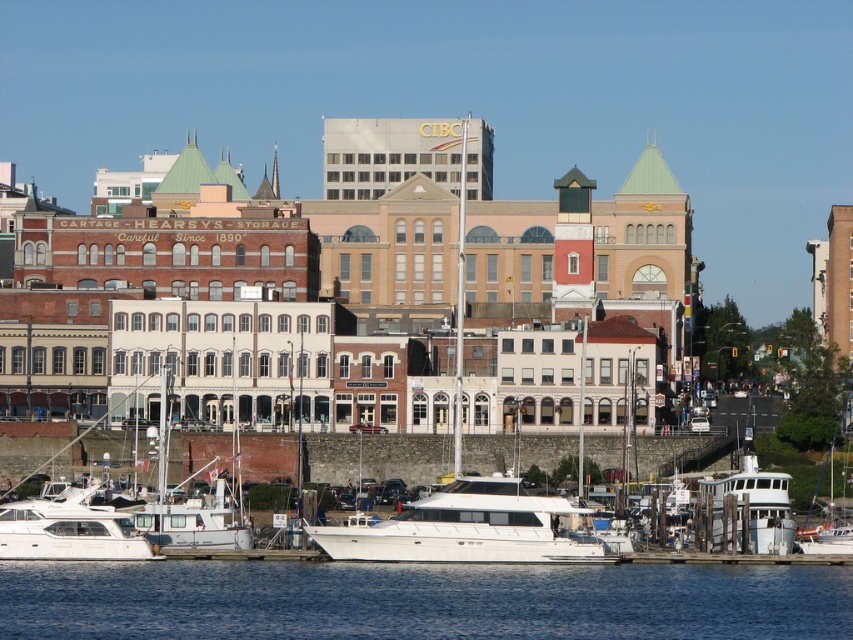
You are a photographer planning to capture the waterfront scene. You want to ensure that both the white glossy boat at center and the white glossy boat at lower right are clearly visible in your shot. Given their heights, which boat might require a higher vantage point to fully capture its structure?

The white glossy boat at center is taller than the white glossy boat at lower right, so the white glossy boat at center might require a higher vantage point to fully capture its structure.

You are standing at the waterfront and see two points marked in the image. The first point is at coordinate point (497, 556) and the second is at point (711, 524). Which point is closer to you?

Point (497, 556) is closer to the camera than point (711, 524).